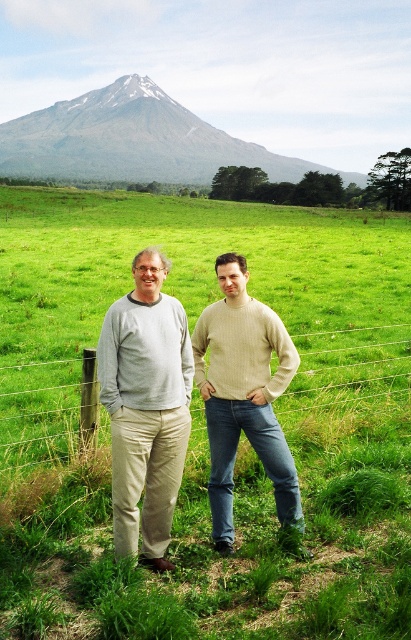
You are a photographer trying to capture both the light beige sweater at center and the gray rocky mountain at upper center in a single frame. Based on their sizes in the image, which object would appear smaller in the photo?

The light beige sweater at center appears smaller in the photo because it occupies less space than the gray rocky mountain at upper center.

You are standing in the field and want to walk from point point (223, 545) to point (133, 448). Which direction should you move relative to the fence?

Since point (223, 545) is closer to you than point (133, 448), you should move away from the fence to reach point (133, 448).

In the image, there are two people wearing sweaters. The first person is wearing a light gray sweater at center, and the second is wearing a light beige sweater at center. From the perspective of someone standing in front of them, which sweater is positioned to the right?

The light beige sweater at center is to the right of the light gray sweater at center.